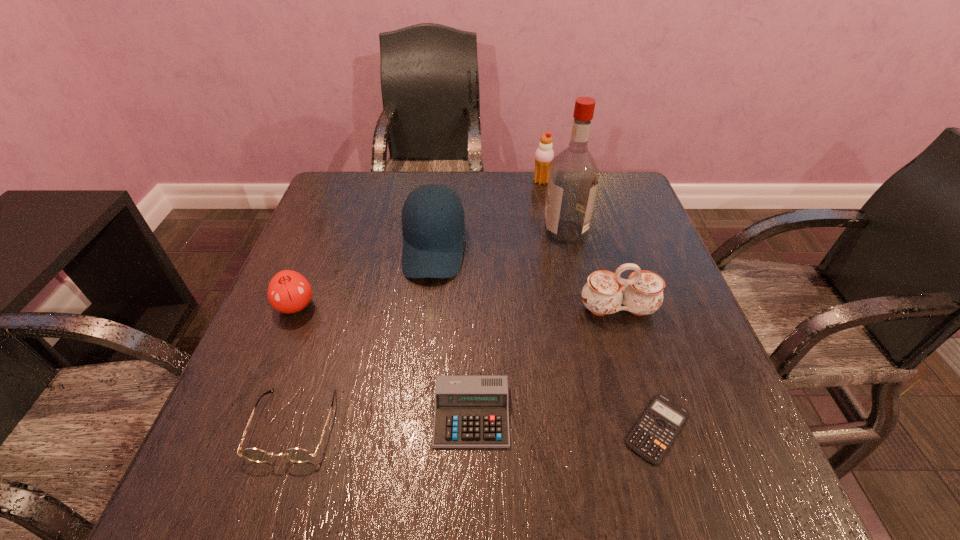
Locate an element on the screen. free space located 0.090m on the front-facing side of the tallest object is located at coordinates (508, 232).

I want to click on vacant space located on the front-facing side of the tallest object, so click(x=455, y=232).

Find the location of `vacant space located on the front-facing side of the tallest object`. vacant space located on the front-facing side of the tallest object is located at coordinates (396, 232).

You are a GUI agent. You are given a task and a screenshot of the screen. Output one action in this format:
    pyautogui.click(x=<x>, y=<y>)
    Task: Click on the vacant space located 0.300m at the front with a straw on the farthest object
    
    Given the screenshot: What is the action you would take?
    pyautogui.click(x=427, y=181)

The width and height of the screenshot is (960, 540). Find the location of `vacant region located 0.300m at the front with a straw on the farthest object`. vacant region located 0.300m at the front with a straw on the farthest object is located at coordinates (427, 181).

Locate an element on the screen. The image size is (960, 540). vacant space located at the front with a straw on the farthest object is located at coordinates pyautogui.click(x=508, y=181).

I want to click on vacant space located 0.060m on the front-facing side of the baseball cap, so click(x=427, y=305).

At what (x,y) coordinates should I click in order to perform the action: click on blank space located 0.160m by the handle of the chinaware. Please return your answer as a coordinate pair (x, y). This screenshot has width=960, height=540. Looking at the image, I should click on (643, 395).

Locate an element on the screen. This screenshot has width=960, height=540. free point located on the right of the apple is located at coordinates (455, 306).

At what (x,y) coordinates should I click in order to perform the action: click on vacant space situated 0.120m on the right of the left calculator. Please return your answer as a coordinate pair (x, y). Looking at the image, I should click on (580, 415).